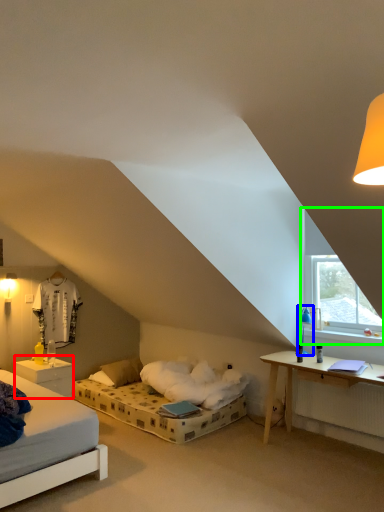
Question: Which is farther away from nightstand (highlighted by a red box)? table lamp (highlighted by a blue box) or window (highlighted by a green box)?

Choices:
 (A) table lamp
 (B) window

Answer: (B)